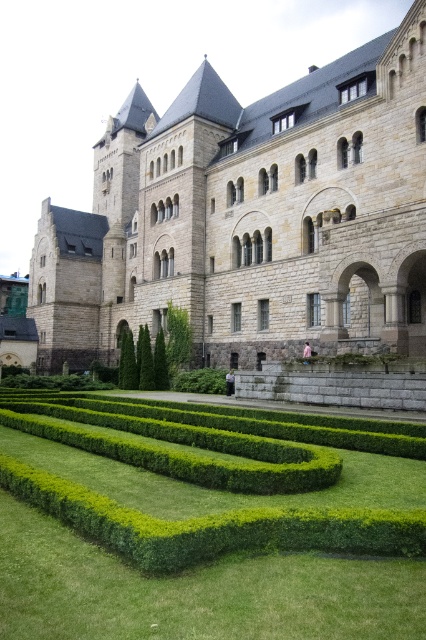
You are a landscape architect designing a new garden. You want to place a statue that is 2 meters tall between the gray stone castle at center and the green leafy bush at lower center. Considering their sizes, which object should the statue be closer to?

The gray stone castle at center is larger in size than the green leafy bush at lower center. To maintain visual balance, the statue should be placed closer to the smaller green leafy bush at lower center to counterbalance the larger castle.

You are standing in front of the historic building and want to determine the relative positions of two points marked on the ground. The first point is labeled as point (402,294) and the second is point (175,342). Which point is closer to you?

Point (402,294) is closer to the viewer than point (175,342).

You are a gardener planning to trim the green hedge at center and the green leafy bush at lower center. Based on their positions, which one should you start with to follow the standard gardening practice of working from top to bottom?

You should start with the green leafy bush at lower center first because it is positioned above the green hedge at center, following the top to bottom gardening practice.